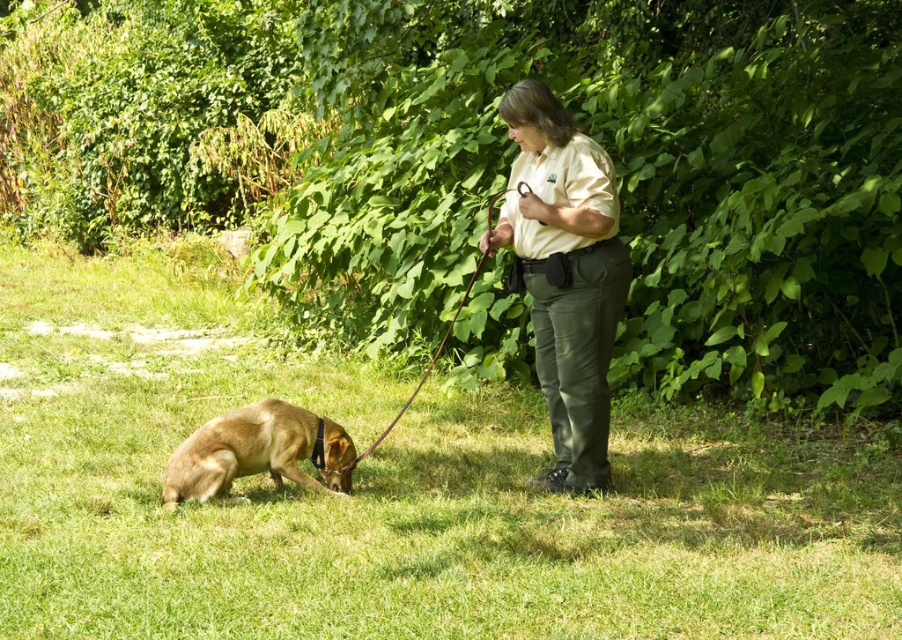
Who is shorter, green grass at lower center or brown matte dog at lower left?

brown matte dog at lower left is shorter.

Can you confirm if green grass at lower center is bigger than brown matte dog at lower left?

Indeed, green grass at lower center has a larger size compared to brown matte dog at lower left.

Is point (195, 406) closer to camera compared to point (327, 452)?

That is False.

This screenshot has height=640, width=902. I want to click on green grass at lower center, so click(x=394, y=492).

Who is more forward, (585, 241) or (443, 339)?

Positioned in front is point (585, 241).

Who is more forward, (569, 168) or (431, 368)?

Positioned in front is point (569, 168).

Where is `matte khaki shirt at center`? matte khaki shirt at center is located at coordinates (564, 275).

Between matte khaki shirt at center and brown matte dog at lower left, which one has less height?

Standing shorter between the two is brown matte dog at lower left.

Between matte khaki shirt at center and brown matte dog at lower left, which one is positioned lower?

Positioned lower is brown matte dog at lower left.

Image resolution: width=902 pixels, height=640 pixels. I want to click on matte khaki shirt at center, so click(564, 275).